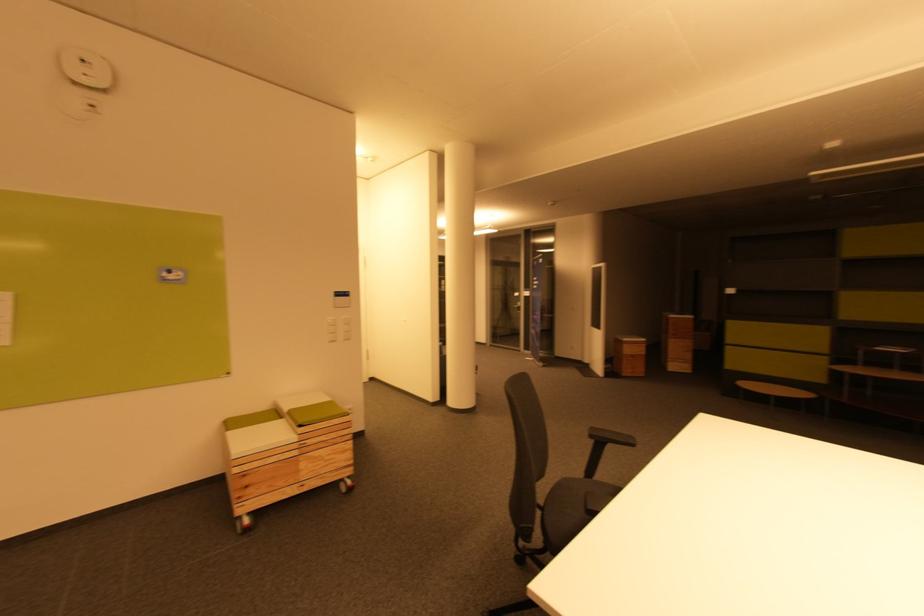
Where is `wooden rolling stool`? Image resolution: width=924 pixels, height=616 pixels. wooden rolling stool is located at coordinates (774, 391).